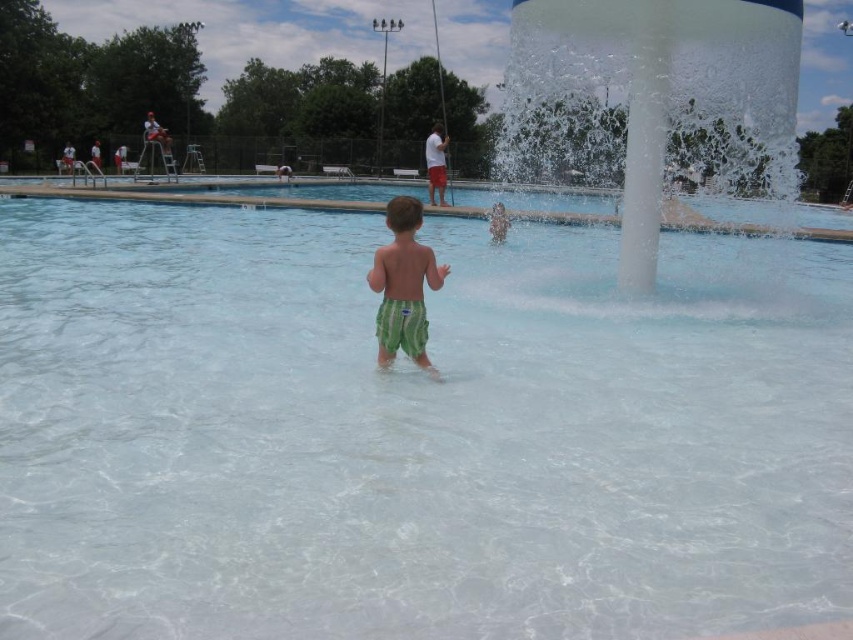
Does white translucent water at center have a lesser height compared to green striped shorts at center?

No.

Image resolution: width=853 pixels, height=640 pixels. Describe the element at coordinates (656, 97) in the screenshot. I see `white translucent water at center` at that location.

At what (x,y) coordinates should I click in order to perform the action: click on white translucent water at center. Please return your answer as a coordinate pair (x, y). This screenshot has width=853, height=640. Looking at the image, I should click on (656, 97).

Between point (579, 269) and point (553, 4), which one is positioned in front?

Point (553, 4) is in front.

Can you confirm if clear glass swimming pool at center is positioned above white translucent water at center?

No.

Between point (360, 268) and point (712, 180), which one is positioned in front?

Point (712, 180)

At what (x,y) coordinates should I click in order to perform the action: click on clear glass swimming pool at center. Please return your answer as a coordinate pair (x, y). Looking at the image, I should click on (413, 433).

Which is more to the right, clear glass swimming pool at center or green striped shorts at center?

clear glass swimming pool at center

Between point (129, 268) and point (415, 307), which one is positioned in front?

Point (415, 307)

Locate an element on the screen. Image resolution: width=853 pixels, height=640 pixels. clear glass swimming pool at center is located at coordinates (413, 433).